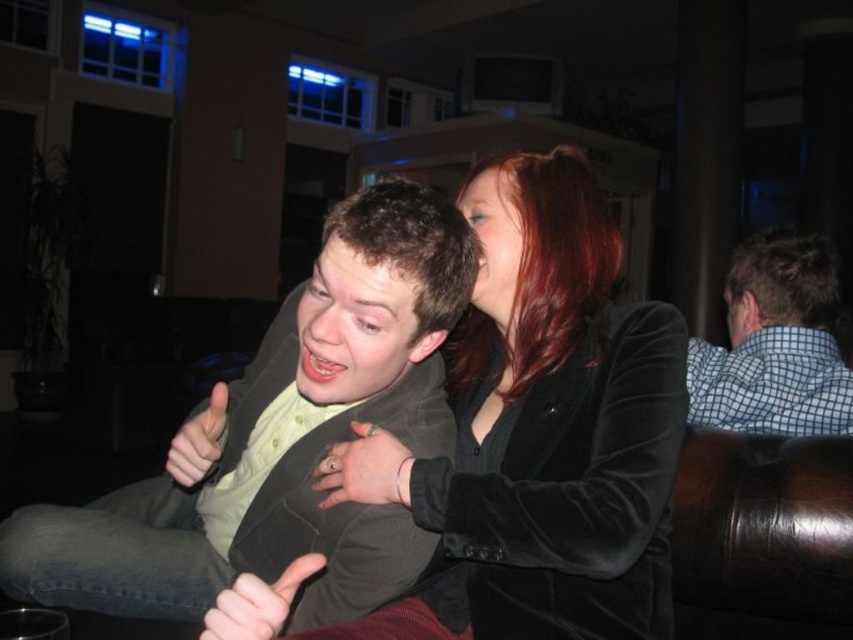
Is velvet black jacket at upper center above matte green shirt at center?

Indeed, velvet black jacket at upper center is positioned over matte green shirt at center.

Looking at this image, does velvet black jacket at upper center have a larger size compared to matte green shirt at center?

Actually, velvet black jacket at upper center might be smaller than matte green shirt at center.

Who is more distant from viewer, (x=589, y=541) or (x=215, y=417)?

The point (x=215, y=417) is behind.

Where is `velvet black jacket at upper center`? The width and height of the screenshot is (853, 640). velvet black jacket at upper center is located at coordinates (547, 429).

Describe the element at coordinates (547, 429) in the screenshot. I see `velvet black jacket at upper center` at that location.

Is point (473, 330) positioned behind point (374, 374)?

Yes, point (473, 330) is farther from viewer.

Where is `velvet black jacket at upper center`? This screenshot has height=640, width=853. velvet black jacket at upper center is located at coordinates (547, 429).

Image resolution: width=853 pixels, height=640 pixels. Describe the element at coordinates (776, 346) in the screenshot. I see `checkered fabric shirt at right` at that location.

In the scene shown: Is checkered fabric shirt at right wider than smooth red hair at upper center?

Yes, checkered fabric shirt at right is wider than smooth red hair at upper center.

Which is in front, point (770, 252) or point (485, 189)?

Point (485, 189) is more forward.

Identify the location of checkered fabric shirt at right. pyautogui.click(x=776, y=346).